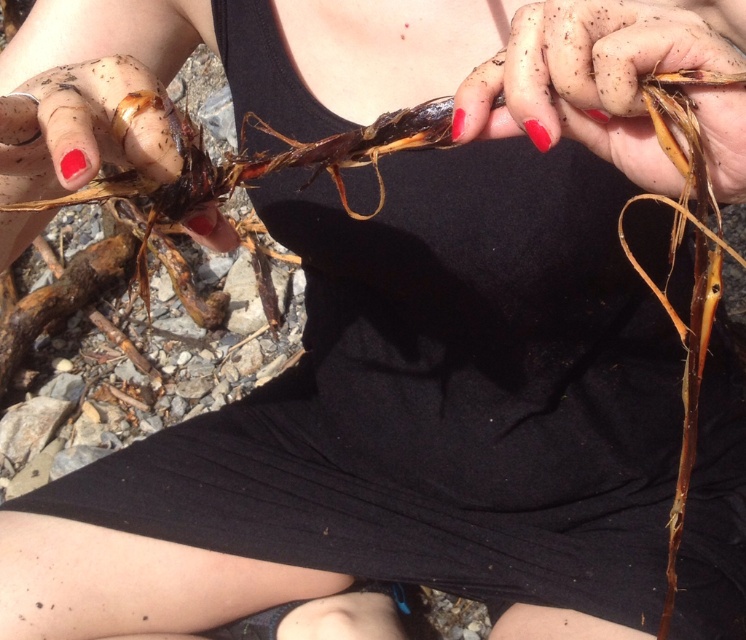
Is dull brown skin at center taller than matte brown root at left?

No.

Can you confirm if dull brown skin at center is smaller than matte brown root at left?

Yes, dull brown skin at center is smaller than matte brown root at left.

Does point (727, 93) lie in front of point (12, 216)?

Yes, point (727, 93) is in front of point (12, 216).

Locate an element on the screen. This screenshot has width=746, height=640. dull brown skin at center is located at coordinates (595, 76).